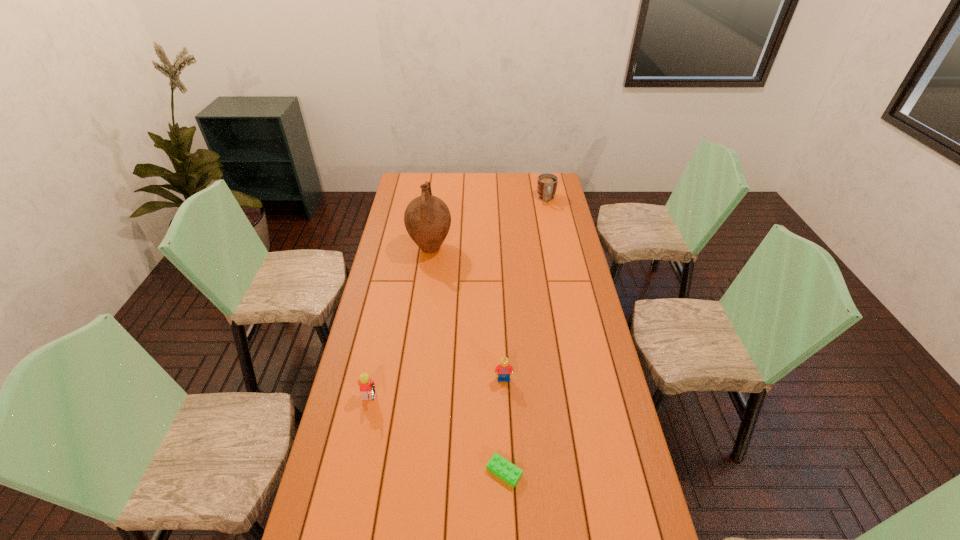
Identify the location of pitcher. This screenshot has width=960, height=540. coord(427,219).

This screenshot has height=540, width=960. Identify the location of the tallest object. (427, 219).

I want to click on the second farthest Lego, so click(367, 386).

Where is `the leftmost Lego`? The height and width of the screenshot is (540, 960). the leftmost Lego is located at coordinates (367, 386).

The width and height of the screenshot is (960, 540). What are the coordinates of `the farthest object` in the screenshot? It's located at (547, 183).

Find the location of a particular element. mug is located at coordinates (547, 183).

The width and height of the screenshot is (960, 540). In order to click on the farthest Lego in this screenshot , I will do `click(504, 369)`.

What are the coordinates of `the nearest object` in the screenshot? It's located at (499, 466).

Image resolution: width=960 pixels, height=540 pixels. Find the location of `the nearest Lego`. the nearest Lego is located at coordinates (499, 466).

The width and height of the screenshot is (960, 540). In order to click on free space located 0.070m on the front of the fourth nearest object in this screenshot , I will do `click(427, 273)`.